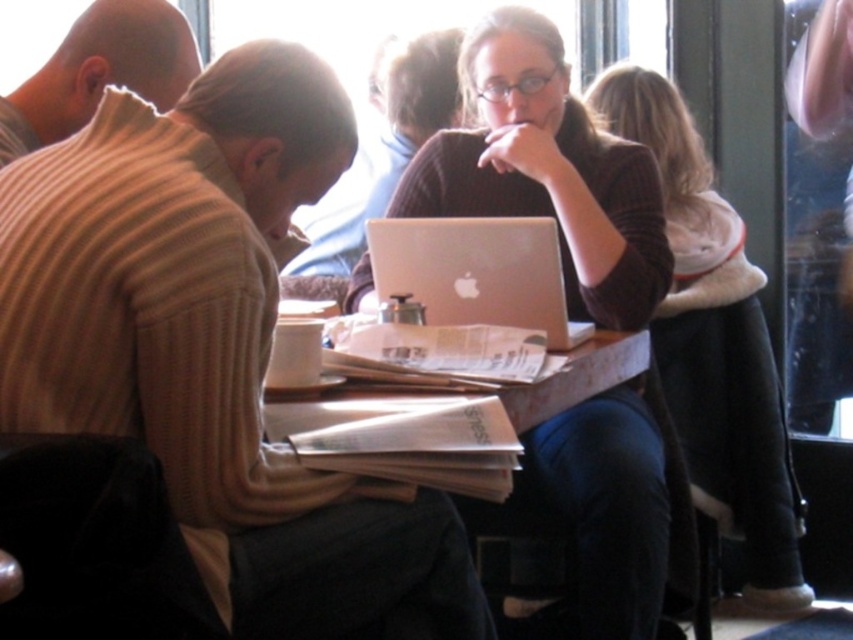
Does point (213, 176) come farther from viewer compared to point (297, 406)?

No, (213, 176) is closer to viewer.

Which is behind, point (141, 426) or point (593, 563)?

Positioned behind is point (593, 563).

At what (x,y) coordinates should I click in order to perform the action: click on beige ribbed sweater at center. Please return your answer as a coordinate pair (x, y). Looking at the image, I should click on (193, 384).

Does point (619, 609) lie in front of point (440, 300)?

Yes, it is.

From the picture: Which of these two, white paper at center or silver metallic laptop at center, stands shorter?

With less height is silver metallic laptop at center.

Does point (612, 538) come closer to viewer compared to point (520, 237)?

Yes, it is in front of point (520, 237).

Where is `white paper at center`? white paper at center is located at coordinates (595, 483).

Can you confirm if beige ribbed sweater at center is positioned to the right of silver metallic laptop at center?

No, beige ribbed sweater at center is not to the right of silver metallic laptop at center.

Who is higher up, beige ribbed sweater at center or silver metallic laptop at center?

silver metallic laptop at center is higher up.

At what (x,y) coordinates should I click in order to perform the action: click on beige ribbed sweater at center. Please return your answer as a coordinate pair (x, y). Looking at the image, I should click on (193, 384).